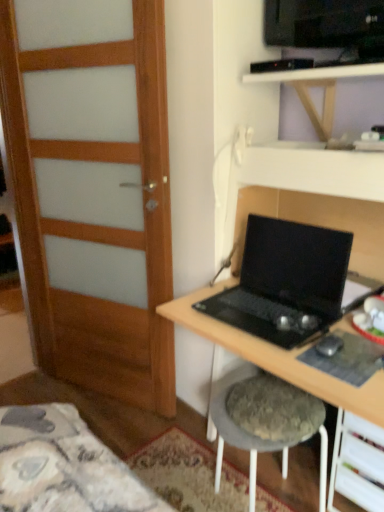
Identify the location of black matte laptop at center. The width and height of the screenshot is (384, 512). (285, 282).

The height and width of the screenshot is (512, 384). Describe the element at coordinates (318, 172) in the screenshot. I see `wooden at upper center` at that location.

Locate an element on the screen. The height and width of the screenshot is (512, 384). wooden at upper center is located at coordinates (318, 172).

Find the location of a particular element. The height and width of the screenshot is (512, 384). black rubber mouse at lower right is located at coordinates (329, 345).

At what (x,y) coordinates should I click in order to perform the action: click on wooden door at left. Please return your answer as a coordinate pair (x, y). This screenshot has height=512, width=384. Looking at the image, I should click on (92, 190).

The width and height of the screenshot is (384, 512). I want to click on black matte desk at center, so click(x=276, y=357).

I want to click on black matte laptop at center, so click(x=285, y=282).

This screenshot has width=384, height=512. In order to click on stool behind the black matte laptop at center in this screenshot , I will do coord(268,424).

Would you say black matte laptop at center is a long distance from fuzzy fabric stool at lower center?

They are positioned close to each other.

Which object is more forward, black matte laptop at center or fuzzy fabric stool at lower center?

Positioned in front is black matte laptop at center.

Considering the relative sizes of black rubber mouse at lower right and black matte desk at center in the image provided, is black rubber mouse at lower right taller than black matte desk at center?

In fact, black rubber mouse at lower right may be shorter than black matte desk at center.

Is black rubber mouse at lower right located outside black matte desk at center?

That's incorrect, black rubber mouse at lower right is not completely outside black matte desk at center.

I want to click on mouse lying above the black matte desk at center (from the image's perspective), so click(x=329, y=345).

From a real-world perspective, does black rubber mouse at lower right sit lower than black matte desk at center?

Actually, black rubber mouse at lower right is physically above black matte desk at center in the real world.

Based on the photo, is black matte desk at center not near fuzzy fabric stool at lower center?

They are positioned close to each other.

Locate an element on the screen. This screenshot has width=384, height=512. stool behind the black matte desk at center is located at coordinates (268, 424).

Considering the sizes of black matte desk at center and fuzzy fabric stool at lower center in the image, is black matte desk at center taller or shorter than fuzzy fabric stool at lower center?

Clearly, black matte desk at center is taller compared to fuzzy fabric stool at lower center.

Considering the relative sizes of black matte laptop at center and wooden door at left in the image provided, is black matte laptop at center wider than wooden door at left?

Correct, the width of black matte laptop at center exceeds that of wooden door at left.

Find the location of a particular element. This screenshot has width=384, height=512. laptop to the right of wooden door at left is located at coordinates (285, 282).

Is there a large distance between black matte laptop at center and wooden door at left?

No, there isn't a large distance between black matte laptop at center and wooden door at left.

Which is closer to the camera, (258, 267) or (2, 102)?

Point (258, 267) appears to be closer to the viewer than point (2, 102).

Identify the location of laptop that appears above the black rubber mouse at lower right (from a real-world perspective). (285, 282).

Is black matte laptop at center turned away from black rubber mouse at lower right?

That's not correct — black matte laptop at center is not looking away from black rubber mouse at lower right.

Is black matte laptop at center bigger than black rubber mouse at lower right?

Indeed, black matte laptop at center has a larger size compared to black rubber mouse at lower right.

In the image, is black matte laptop at center on the left side or the right side of black rubber mouse at lower right?

In the image, black matte laptop at center appears on the left side of black rubber mouse at lower right.

Which of these two, wooden at upper center or black matte laptop at center, stands shorter?

Standing shorter between the two is wooden at upper center.

Which point is more forward, (282, 179) or (302, 236)?

Point (302, 236)

From the image's perspective, which is above, wooden at upper center or black matte laptop at center?

wooden at upper center.

Considering the relative positions of wooden at upper center and black matte laptop at center in the image provided, is wooden at upper center to the left or to the right of black matte laptop at center?

In the image, wooden at upper center appears on the right side of black matte laptop at center.

Which is behind, point (331, 356) or point (276, 168)?

The point (276, 168) is farther.

Is black rubber mouse at lower right far away from wooden at upper center?

They are positioned close to each other.

From the picture: Who is taller, black rubber mouse at lower right or wooden at upper center?

With more height is wooden at upper center.

Find the location of a particular element. This screenshot has width=384, height=512. stool behind the black matte laptop at center is located at coordinates (268, 424).

Locate an element on the screen. mouse above the black matte desk at center (from the image's perspective) is located at coordinates (329, 345).

Looking at the image, which one is located closer to wooden door at left, white plastic drawer at lower right or black matte laptop at center?

Among the two, black matte laptop at center is located nearer to wooden door at left.

Estimate the real-world distances between objects in this image. Which object is further from white plastic drawer at lower right, wooden at upper center or black matte laptop at center?

wooden at upper center is positioned further to the anchor white plastic drawer at lower right.

Considering their positions, is fuzzy fabric stool at lower center positioned further to black matte desk at center than wooden door at left?

wooden door at left is further to black matte desk at center.

From the image, which object appears to be farther from white plastic drawer at lower right, wooden at upper center or black rubber mouse at lower right?

wooden at upper center lies further to white plastic drawer at lower right than the other object.

From the image, which object appears to be nearer to black matte desk at center, fuzzy fabric stool at lower center or black rubber mouse at lower right?

black rubber mouse at lower right lies closer to black matte desk at center than the other object.

Which object lies further to the anchor point black matte laptop at center, black matte desk at center or black rubber mouse at lower right?

Among the two, black rubber mouse at lower right is located further to black matte laptop at center.

Estimate the real-world distances between objects in this image. Which object is further from black rubber mouse at lower right, black matte desk at center or black matte laptop at center?

black matte desk at center is positioned further to the anchor black rubber mouse at lower right.

Which object lies nearer to the anchor point white plastic drawer at lower right, fuzzy fabric stool at lower center or black matte desk at center?

Based on the image, fuzzy fabric stool at lower center appears to be nearer to white plastic drawer at lower right.

You are a GUI agent. You are given a task and a screenshot of the screen. Output one action in this format:
    pyautogui.click(x=<x>, y=<y>)
    Task: Click on the stool between wooden door at left and black rubber mouse at lower right
    
    Given the screenshot: What is the action you would take?
    pyautogui.click(x=268, y=424)

Locate an element on the screen. shelf between wooden door at left and white plastic drawer at lower right is located at coordinates (318, 172).

You are a GUI agent. You are given a task and a screenshot of the screen. Output one action in this format:
    pyautogui.click(x=<x>, y=<y>)
    Task: Click on the stool between black rubber mouse at lower right and white plastic drawer at lower right vertically
    The image size is (384, 512).
    Given the screenshot: What is the action you would take?
    pyautogui.click(x=268, y=424)

Find the location of `laptop between wooden at upper center and black rubber mouse at lower right in the up-down direction`. laptop between wooden at upper center and black rubber mouse at lower right in the up-down direction is located at coordinates (285, 282).